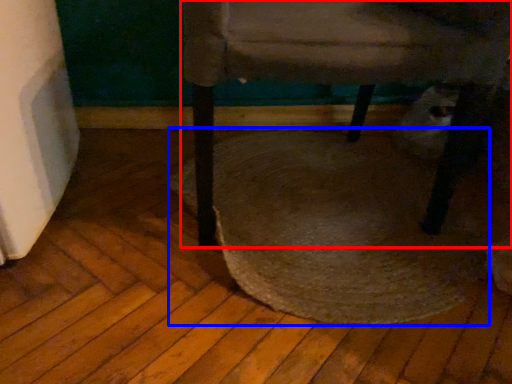
Question: Which point is further to the camera, chair (highlighted by a red box) or mat (highlighted by a blue box)?

Choices:
 (A) chair
 (B) mat

Answer: (B)